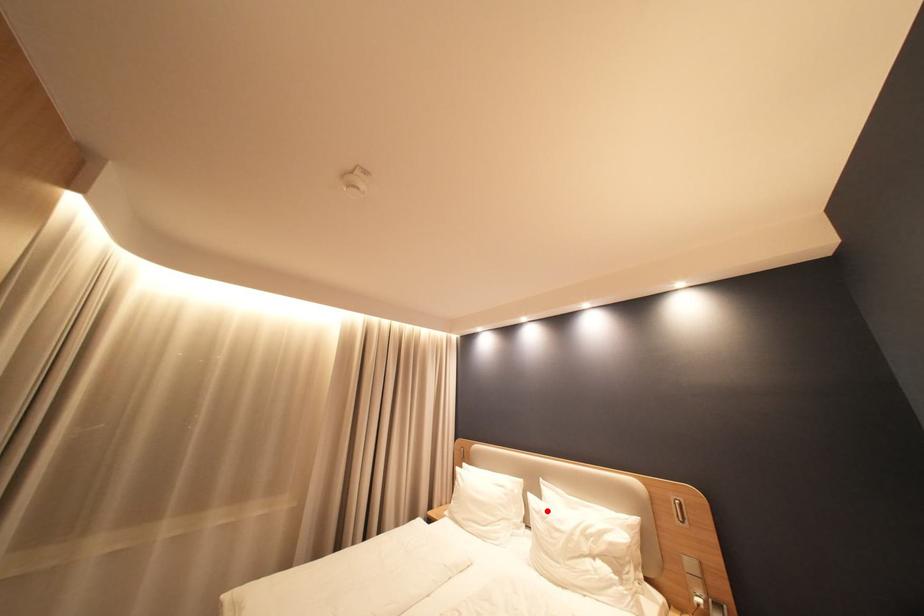
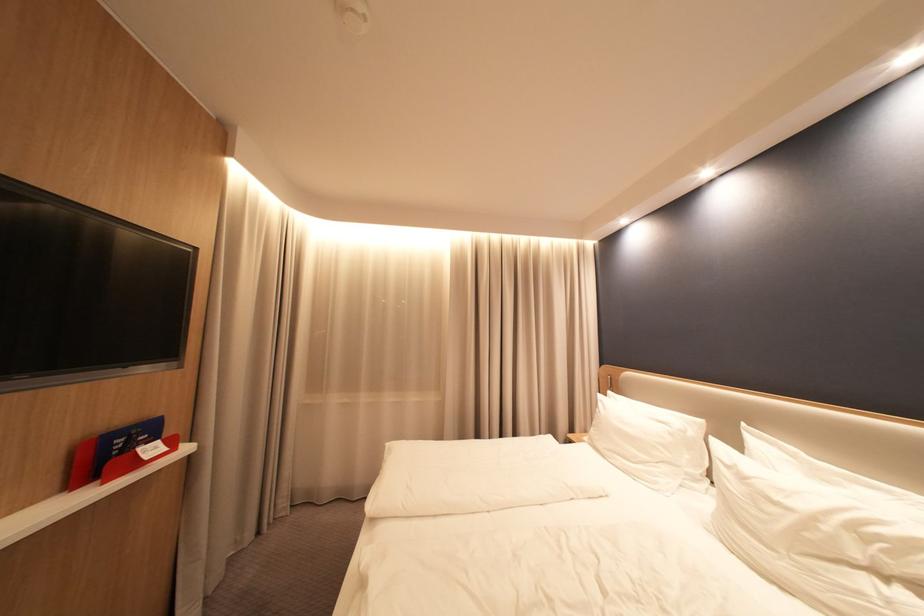
Question: I am providing you with two images of the same scene from different viewpoints. A red point is marked on the first image. At the location where the point appears in image 1, is it still visible in image 2?

Choices:
 (A) Yes
 (B) No

Answer: (A)